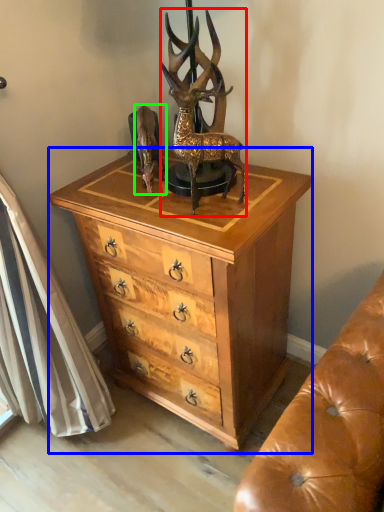
Question: Based on their relative distances, which object is nearer to deer (highlighted by a red box)? Choose from chest of drawers (highlighted by a blue box) and animal (highlighted by a green box).

Choices:
 (A) chest of drawers
 (B) animal

Answer: (B)